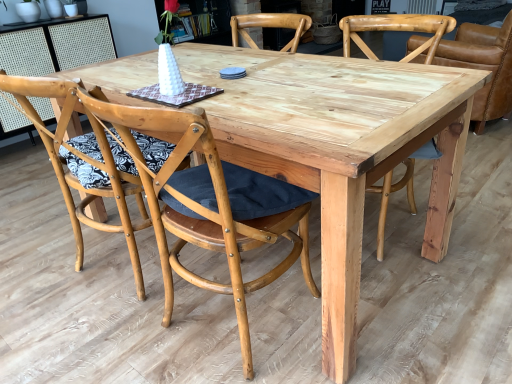
Locate an element on the screen. The image size is (512, 384). vacant region to the left of natural wood chair at center, which is the 4th chair in right-to-left order is located at coordinates (40, 264).